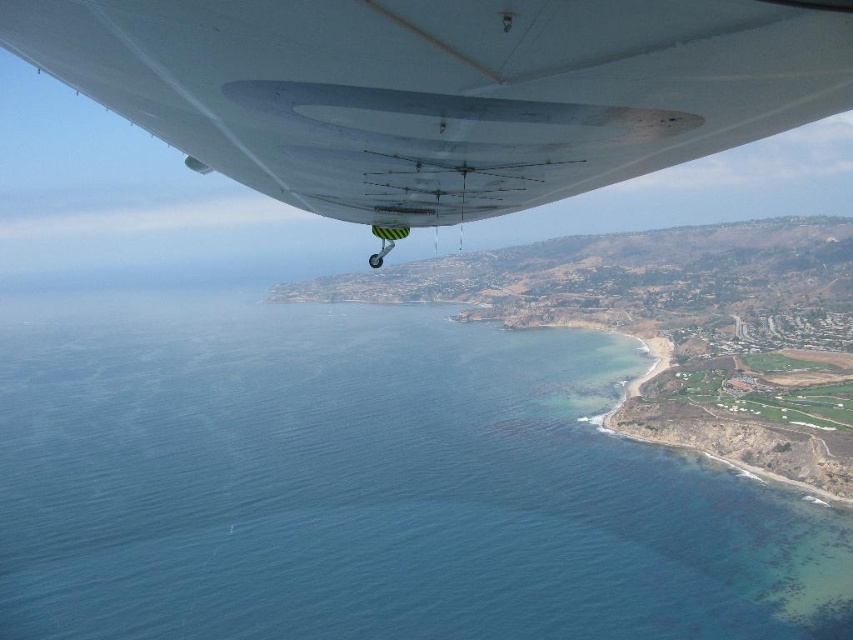
Can you confirm if blue water at lower left is positioned to the left of white matte wing at upper center?

Indeed, blue water at lower left is positioned on the left side of white matte wing at upper center.

Measure the distance from blue water at lower left to white matte wing at upper center.

blue water at lower left and white matte wing at upper center are 378.50 meters apart from each other.

Identify the location of blue water at lower left. The image size is (853, 640). (369, 484).